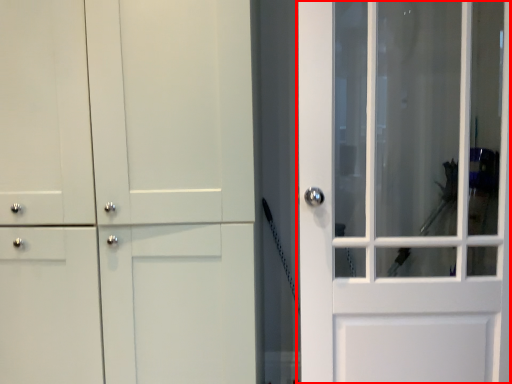
Question: From the image's perspective, what is the correct spatial relationship of door (annotated by the red box) in relation to barn door?

Choices:
 (A) above
 (B) below

Answer: (A)